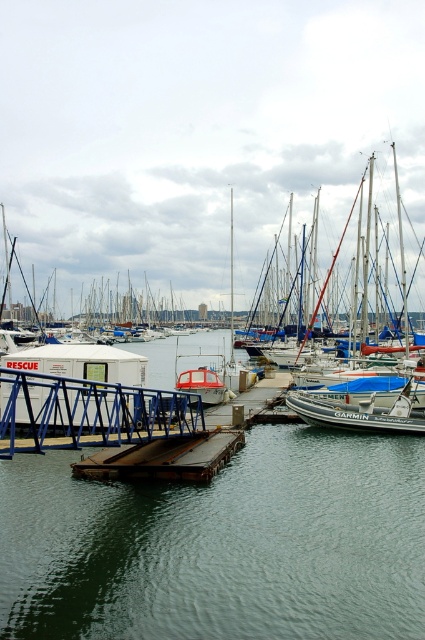
Does green water at center come in front of rusty metal dock at center?

That is True.

Does point (249, 438) come farther from viewer compared to point (221, 448)?

Yes, point (249, 438) is behind point (221, 448).

Does point (300, 611) come closer to viewer compared to point (207, 461)?

Yes, point (300, 611) is closer to viewer.

Locate an element on the screen. The image size is (425, 640). green water at center is located at coordinates (221, 545).